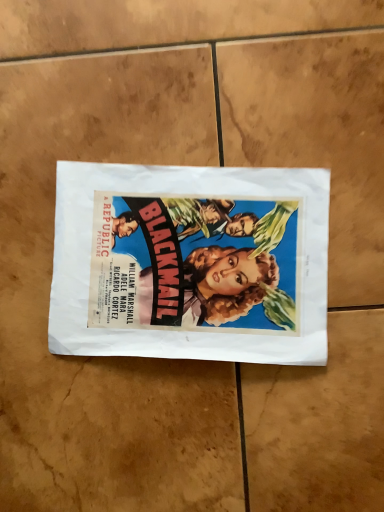
In order to click on free spot above matte paper poster at center (from a real-world perspective) in this screenshot , I will do `click(178, 260)`.